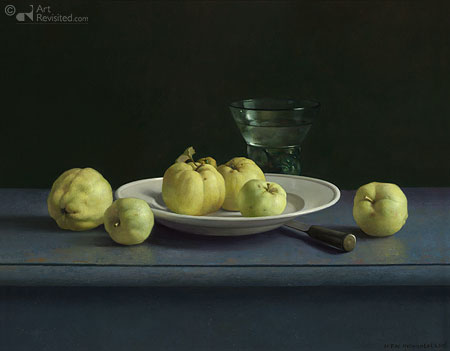
The width and height of the screenshot is (450, 351). Identify the location of table. pyautogui.click(x=322, y=270).